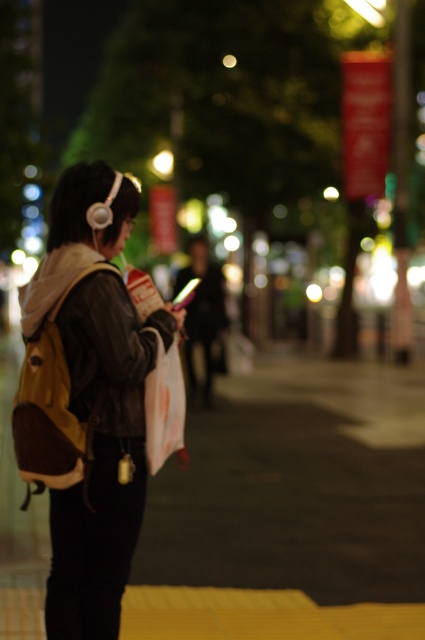
You are a photographer adjusting your camera settings to focus on two points in the scene. The first point is at coordinates point (204,484) and the second is at point (132,404). Which point should you focus on first if you want to ensure both points are in focus?

You should focus on point (132,404) first because it is closer to the camera than point (204,484). By focusing on the closer point, the farther point will also be within the depth of field.

You are a delivery robot with a 3.5 feet wide package. You need to move from the yellow asphalt at center to the leather jacket at left. Can you pass through the space between them?

The distance between the yellow asphalt at center and the leather jacket at left is 9.59 feet. Since the package is 3.5 feet wide, there is sufficient space for the delivery robot to pass through the gap between them.